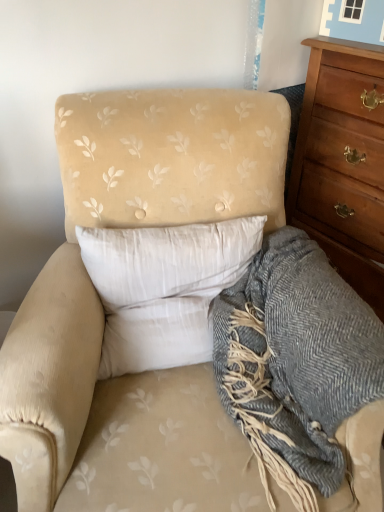
Image resolution: width=384 pixels, height=512 pixels. What do you see at coordinates (295, 362) in the screenshot?
I see `gray woolen blanket at lower right` at bounding box center [295, 362].

Measure the distance between gray woolen blanket at lower right and camera.

gray woolen blanket at lower right is 29.19 inches from camera.

What do you see at coordinates (164, 288) in the screenshot?
I see `white soft pillow at center` at bounding box center [164, 288].

What is the approximate height of wooden chest of drawers at right?

wooden chest of drawers at right is 1.01 meters in height.

What do you see at coordinates (342, 162) in the screenshot?
I see `wooden chest of drawers at right` at bounding box center [342, 162].

Locate an element on the screen. gray woolen blanket at lower right is located at coordinates click(295, 362).

Where is `pillow above the gray woolen blanket at lower right (from the image's perspective)`? pillow above the gray woolen blanket at lower right (from the image's perspective) is located at coordinates (164, 288).

Who is bigger, white soft pillow at center or gray woolen blanket at lower right?

Bigger between the two is gray woolen blanket at lower right.

From a real-world perspective, is white soft pillow at center physically above gray woolen blanket at lower right?

Yes.

How many degrees apart are the facing directions of white soft pillow at center and wooden chest of drawers at right?

62.1 degrees separate the facing orientations of white soft pillow at center and wooden chest of drawers at right.

Can we say white soft pillow at center lies outside wooden chest of drawers at right?

Yes, white soft pillow at center is not within wooden chest of drawers at right.

From the image's perspective, is white soft pillow at center located beneath wooden chest of drawers at right?

Yes, from the image's perspective, white soft pillow at center is below wooden chest of drawers at right.

Identify the location of pillow on the left side of wooden chest of drawers at right. (164, 288).

Based on the photo, from the image's perspective, does wooden chest of drawers at right appear higher than white soft pillow at center?

Yes, from the image's perspective, wooden chest of drawers at right is over white soft pillow at center.

Is wooden chest of drawers at right bigger than white soft pillow at center?

Yes, wooden chest of drawers at right is bigger than white soft pillow at center.

Is wooden chest of drawers at right oriented towards white soft pillow at center?

Yes, wooden chest of drawers at right faces towards white soft pillow at center.

Is wooden chest of drawers at right further to the viewer compared to white soft pillow at center?

Yes.

Which object is wider, wooden chest of drawers at right or gray woolen blanket at lower right?

gray woolen blanket at lower right.

Identify the location of blanket on the left of the wooden chest of drawers at right. The height and width of the screenshot is (512, 384). (295, 362).

From the picture: Can you confirm if wooden chest of drawers at right is positioned to the left of gray woolen blanket at lower right?

No, wooden chest of drawers at right is not to the left of gray woolen blanket at lower right.

The height and width of the screenshot is (512, 384). Find the location of `blanket below the wooden chest of drawers at right (from the image's perspective)`. blanket below the wooden chest of drawers at right (from the image's perspective) is located at coordinates (295, 362).

From the image's perspective, is gray woolen blanket at lower right positioned above or below wooden chest of drawers at right?

gray woolen blanket at lower right is below wooden chest of drawers at right.

Is the surface of gray woolen blanket at lower right in direct contact with wooden chest of drawers at right?

No, gray woolen blanket at lower right is not beside wooden chest of drawers at right.

In terms of size, does gray woolen blanket at lower right appear bigger or smaller than white soft pillow at center?

In the image, gray woolen blanket at lower right appears to be larger than white soft pillow at center.

In the image, is gray woolen blanket at lower right on the left side or the right side of white soft pillow at center?

gray woolen blanket at lower right is positioned on white soft pillow at center's right side.

Does gray woolen blanket at lower right have a lesser height compared to white soft pillow at center?

Incorrect, the height of gray woolen blanket at lower right does not fall short of that of white soft pillow at center.

Looking at their sizes, would you say gray woolen blanket at lower right is wider or thinner than white soft pillow at center?

gray woolen blanket at lower right is wider than white soft pillow at center.

Locate an element on the screen. The width and height of the screenshot is (384, 512). pillow lying on the left of gray woolen blanket at lower right is located at coordinates (164, 288).

In the image, there is a white soft pillow at center. Where is `the chest of drawers above it (from the image's perspective)`? This screenshot has width=384, height=512. the chest of drawers above it (from the image's perspective) is located at coordinates (342, 162).

When comparing their distances from gray woolen blanket at lower right, does white soft pillow at center or wooden chest of drawers at right seem further?

wooden chest of drawers at right is positioned further to the anchor gray woolen blanket at lower right.

From the image, which object appears to be nearer to wooden chest of drawers at right, gray woolen blanket at lower right or white soft pillow at center?

Based on the image, gray woolen blanket at lower right appears to be nearer to wooden chest of drawers at right.

Considering their positions, is white soft pillow at center positioned further to wooden chest of drawers at right than gray woolen blanket at lower right?

white soft pillow at center is further to wooden chest of drawers at right.

Estimate the real-world distances between objects in this image. Which object is further from gray woolen blanket at lower right, wooden chest of drawers at right or white soft pillow at center?

Among the two, wooden chest of drawers at right is located further to gray woolen blanket at lower right.

Looking at this image, considering their positions, is gray woolen blanket at lower right positioned closer to white soft pillow at center than wooden chest of drawers at right?

gray woolen blanket at lower right.

Which object lies nearer to the anchor point white soft pillow at center, wooden chest of drawers at right or gray woolen blanket at lower right?

The object closer to white soft pillow at center is gray woolen blanket at lower right.

Where is `blanket between white soft pillow at center and wooden chest of drawers at right`? blanket between white soft pillow at center and wooden chest of drawers at right is located at coordinates (295, 362).